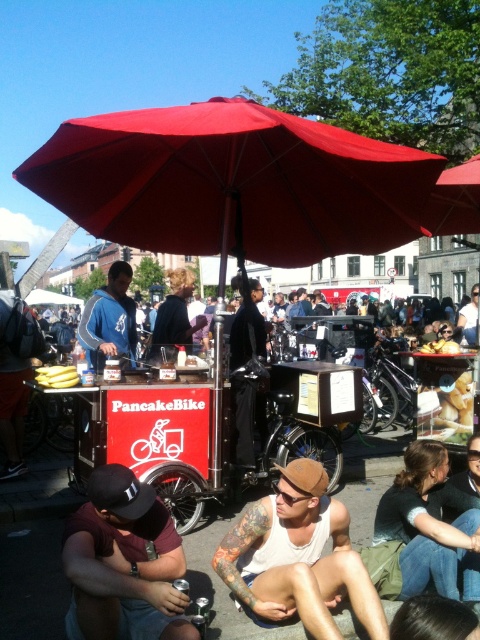
Question: Does maroon fabric shirt at lower left appear under blue fleece jacket at center?

Choices:
 (A) yes
 (B) no

Answer: (A)

Question: From the image, what is the correct spatial relationship of white tank top at center in relation to blue fleece jacket at center?

Choices:
 (A) right
 (B) left

Answer: (A)

Question: Which point is closer to the camera taking this photo?

Choices:
 (A) (96, 161)
 (B) (130, 314)

Answer: (A)

Question: Among these points, which one is farthest from the camera?

Choices:
 (A) (324, 572)
 (B) (141, 563)
 (C) (100, 369)
 (D) (63, 376)

Answer: (C)

Question: Which of the following is the closest to the observer?

Choices:
 (A) white tank top at center
 (B) blue fleece jacket at center
 (C) red fabric umbrella at center

Answer: (A)

Question: Does white tank top at center have a larger size compared to maroon fabric shirt at lower left?

Choices:
 (A) no
 (B) yes

Answer: (B)